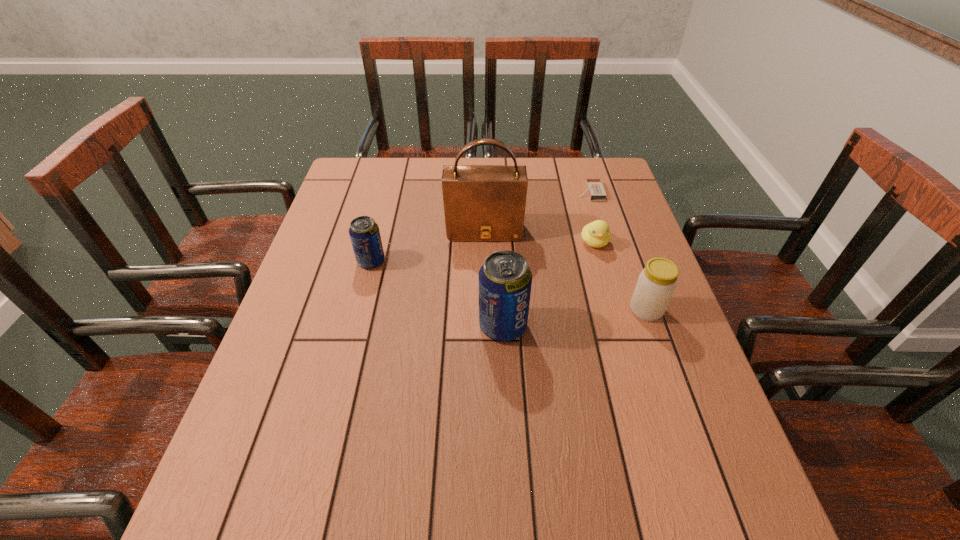
Where is `free space between the taller soda and the second shortest object`? The height and width of the screenshot is (540, 960). free space between the taller soda and the second shortest object is located at coordinates (548, 284).

The width and height of the screenshot is (960, 540). In order to click on free area in between the matchbox and the fifth shortest object in this screenshot , I will do `click(546, 259)`.

Where is `free point between the tallest object and the duckling`? Image resolution: width=960 pixels, height=540 pixels. free point between the tallest object and the duckling is located at coordinates (540, 237).

The width and height of the screenshot is (960, 540). What are the coordinates of `unoccupied area between the fifth tallest object and the farthest object` in the screenshot? It's located at (592, 217).

The height and width of the screenshot is (540, 960). I want to click on empty location between the shoulder bag and the farthest object, so click(538, 211).

The width and height of the screenshot is (960, 540). Find the location of `unoccupied area between the shortest object and the second shortest object`. unoccupied area between the shortest object and the second shortest object is located at coordinates (592, 217).

Find the location of a particular element. blank region between the matchbox and the second tallest object is located at coordinates 546,259.

You are a GUI agent. You are given a task and a screenshot of the screen. Output one action in this format:
    pyautogui.click(x=<x>, y=<y>)
    Task: Click on the free space that is in between the matchbox and the nearer soda
    This screenshot has height=540, width=960.
    Given the screenshot: What is the action you would take?
    pyautogui.click(x=546, y=259)

This screenshot has width=960, height=540. What are the coordinates of `vacant area that lies between the duckling and the shoulder bag` in the screenshot? It's located at (540, 237).

You are a GUI agent. You are given a task and a screenshot of the screen. Output one action in this format:
    pyautogui.click(x=<x>, y=<y>)
    Task: Click on the object that stands as the closest to the tallest object
    This screenshot has width=960, height=540.
    Given the screenshot: What is the action you would take?
    pyautogui.click(x=596, y=234)